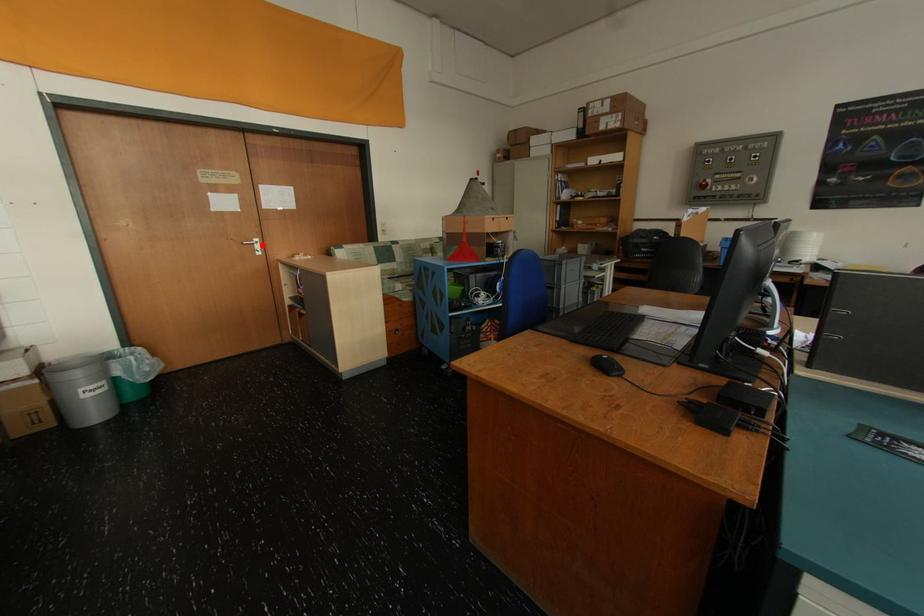
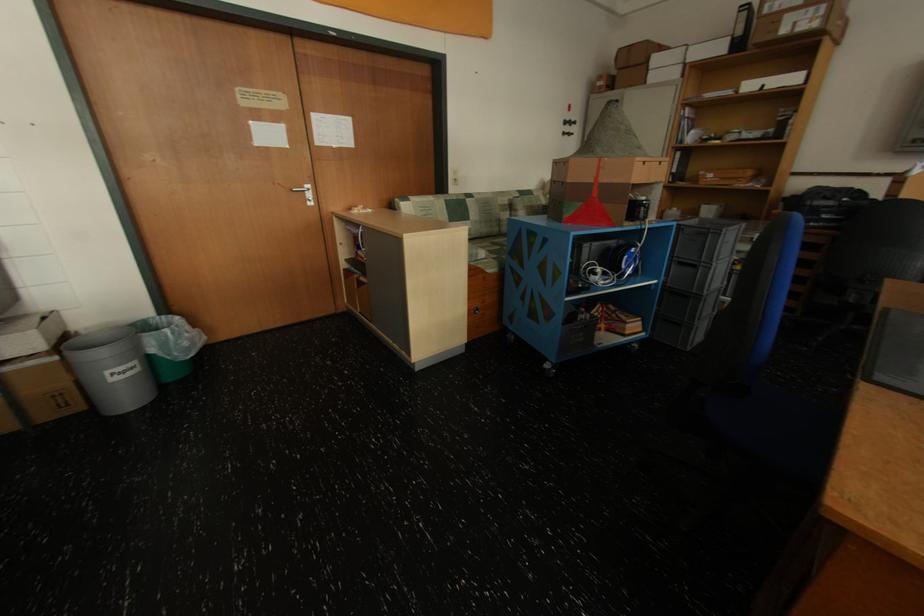
The point at the highlighted location is marked in the first image. Where is the corresponding point in the second image?

(312, 192)